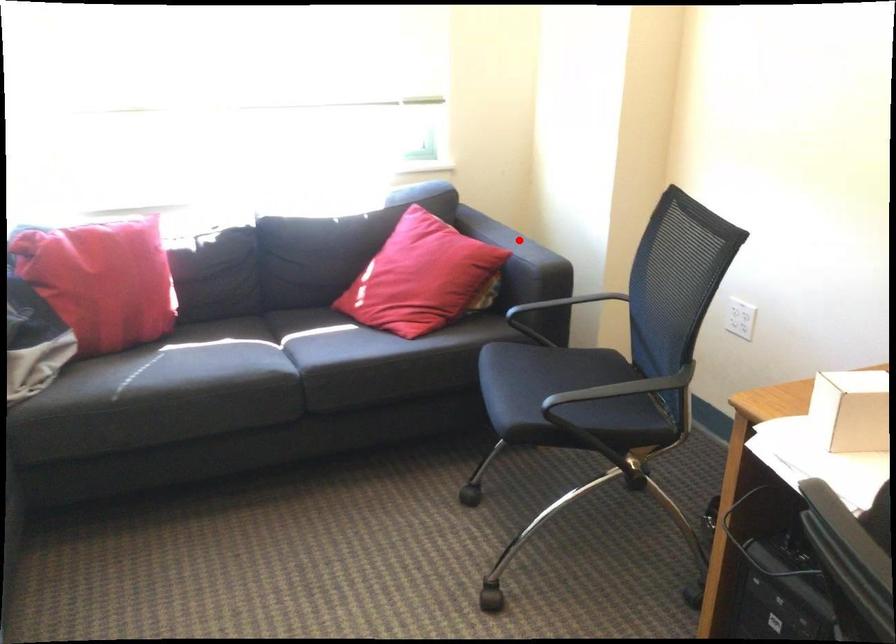
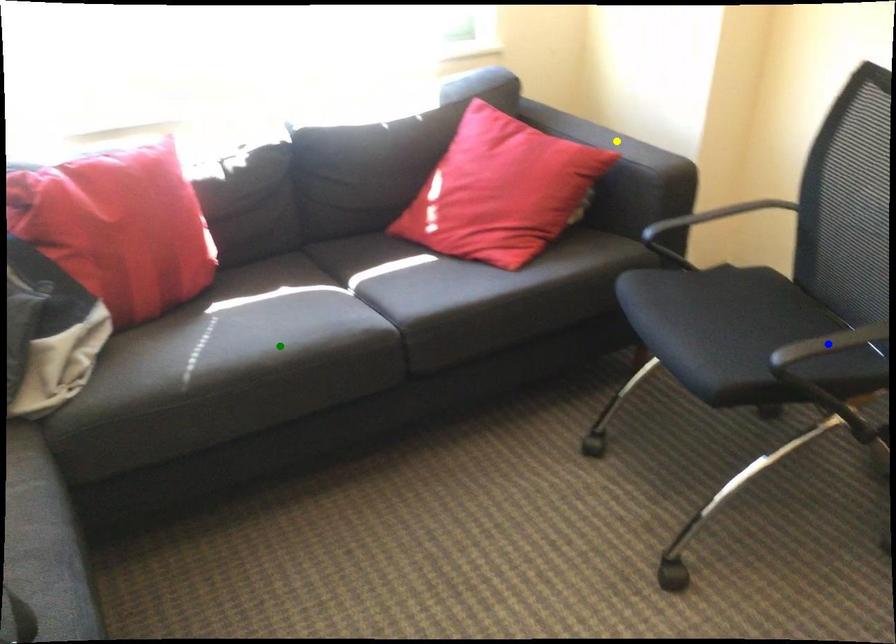
Question: I am providing you with two images of the same scene from different viewpoints. A red point is marked on the first image. You are given multiple points on the second image. Can you choose the point in image 2 that corresponds to the point in image 1?

Choices:
 (A) green point
 (B) yellow point
 (C) blue point

Answer: (B)